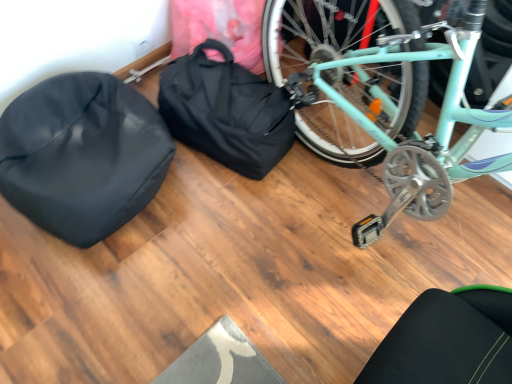
This screenshot has height=384, width=512. Identify the location of free space in front of black fabric bag at center. (238, 211).